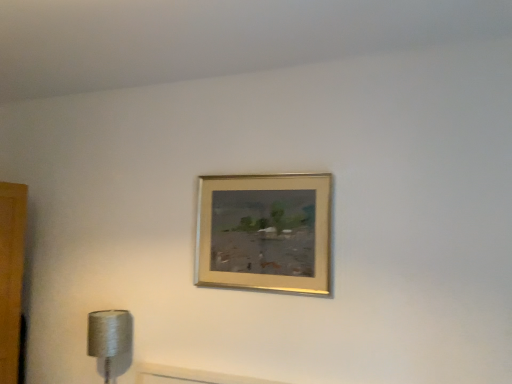
Question: Is silver metallic lamp at lower left in front of or behind gold metallic picture frame at upper center in the image?

Choices:
 (A) front
 (B) behind

Answer: (B)

Question: Looking at their shapes, would you say silver metallic lamp at lower left is wider or thinner than gold metallic picture frame at upper center?

Choices:
 (A) wide
 (B) thin

Answer: (A)

Question: Is silver metallic lamp at lower left to the left or to the right of gold metallic picture frame at upper center in the image?

Choices:
 (A) right
 (B) left

Answer: (B)

Question: Considering the positions of gold metallic picture frame at upper center and silver metallic lamp at lower left in the image, is gold metallic picture frame at upper center taller or shorter than silver metallic lamp at lower left?

Choices:
 (A) tall
 (B) short

Answer: (A)

Question: Is gold metallic picture frame at upper center bigger or smaller than silver metallic lamp at lower left?

Choices:
 (A) small
 (B) big

Answer: (A)

Question: Relative to silver metallic lamp at lower left, is gold metallic picture frame at upper center in front or behind?

Choices:
 (A) behind
 (B) front

Answer: (B)

Question: Does point click(303, 243) appear closer or farther from the camera than point click(106, 349)?

Choices:
 (A) closer
 (B) farther

Answer: (A)